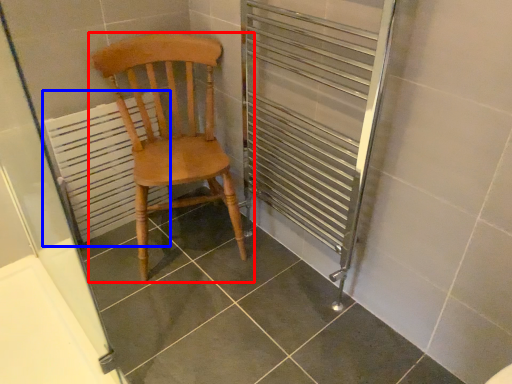
Question: Among these objects, which one is farthest to the camera, chair (highlighted by a red box) or radiator (highlighted by a blue box)?

Choices:
 (A) chair
 (B) radiator

Answer: (B)